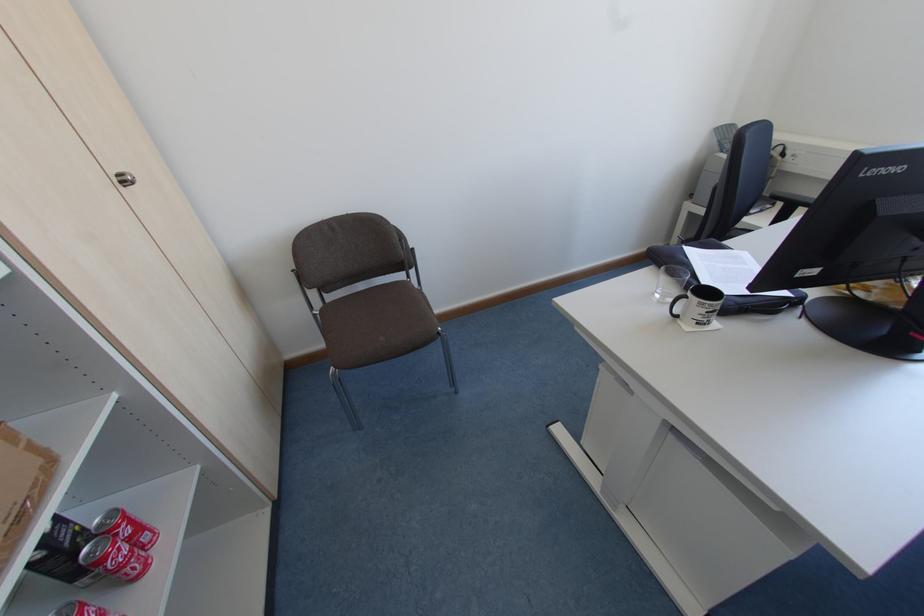
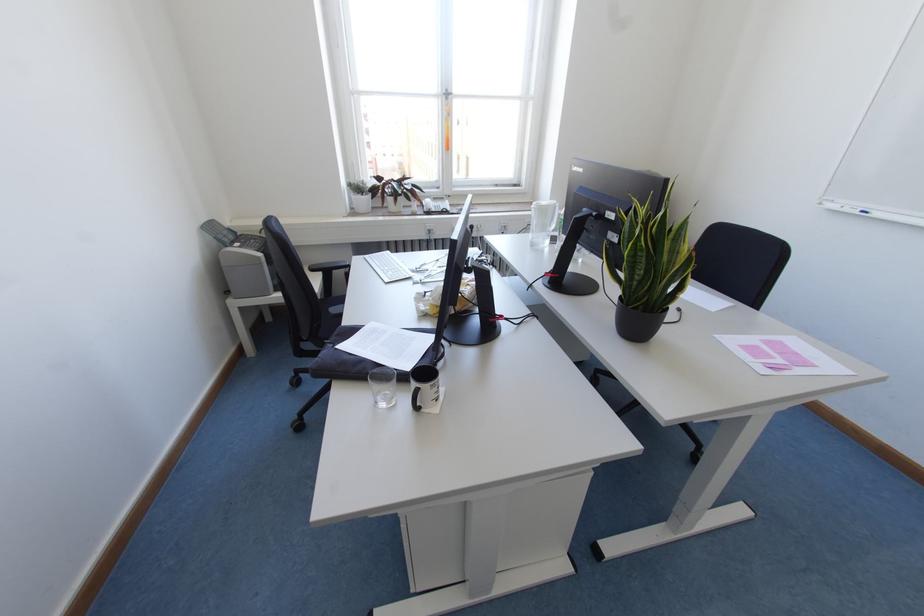
Where in the second image is the point corresponding to point (773, 197) from the first image?

(312, 270)